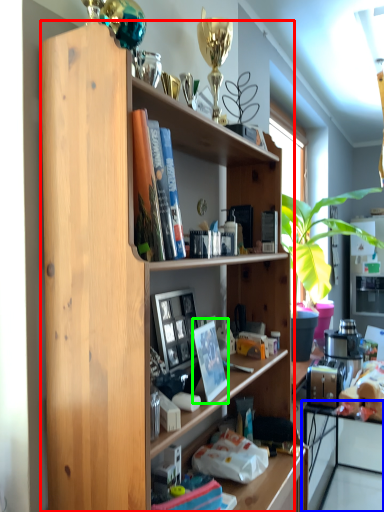
Question: Which object is the closest to the shelf (highlighted by a red box)? Choose among these: computer (highlighted by a blue box) or paperback book (highlighted by a green box).

Choices:
 (A) computer
 (B) paperback book

Answer: (B)